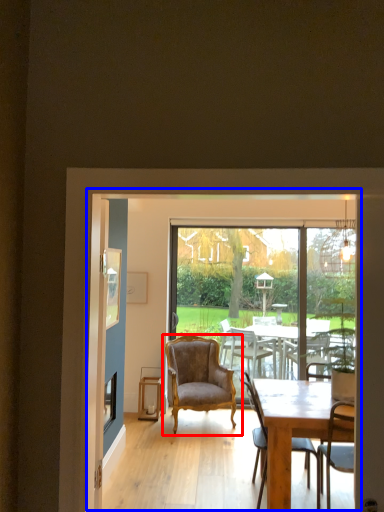
Question: Which object is further to the camera taking this photo, chair (highlighted by a red box) or screen door (highlighted by a blue box)?

Choices:
 (A) chair
 (B) screen door

Answer: (A)